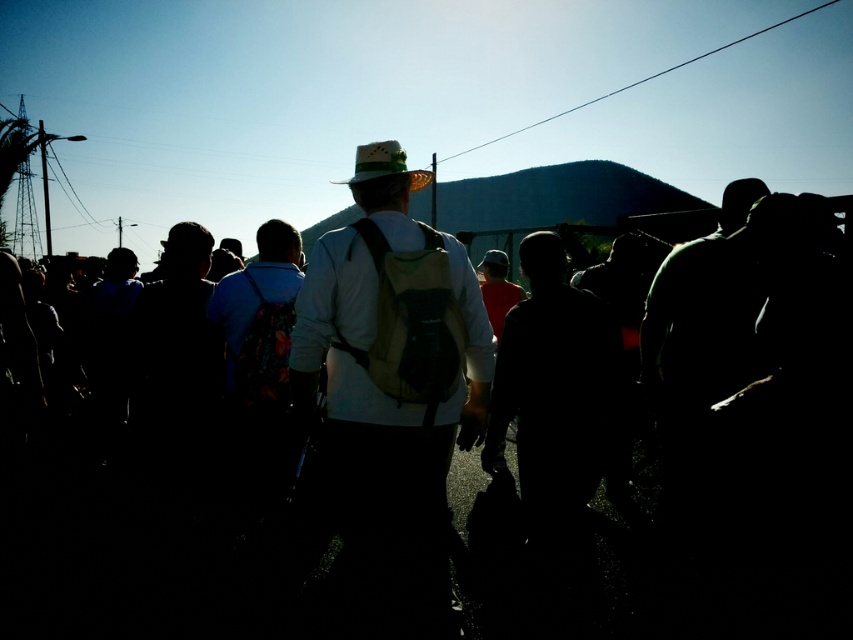
You are a photographer trying to capture the group of people in the scene. You notice the white matte shirt at center and the green felt cowboy hat at center. Which object is positioned higher in the image?

The green felt cowboy hat at center is positioned higher than the white matte shirt at center because the white matte shirt at center is located below the green felt cowboy hat at center.

You are a photographer trying to capture the silhouette crowd at center and the white matte shirt at center in a single frame. Based on their positions, which object should you adjust your camera to focus on first to ensure both are in the frame?

Since the silhouette crowd at center is to the right of the white matte shirt at center, you should focus on the white matte shirt at center first to ensure both are included in the frame.